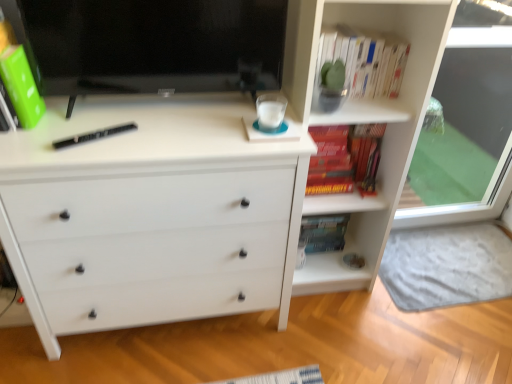
Locate an element on the screen. The image size is (512, 384). free space on the front side of black hardback book at center is located at coordinates (78, 156).